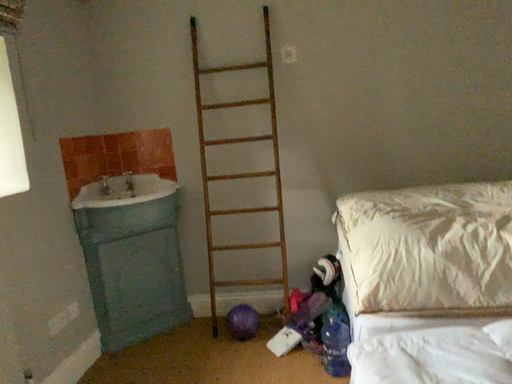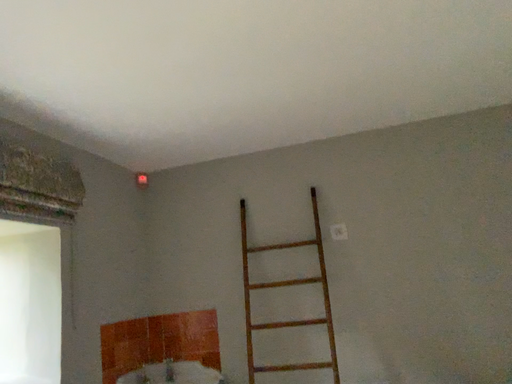
Question: Which way did the camera rotate in the video?

Choices:
 (A) rotated upward
 (B) rotated downward

Answer: (A)